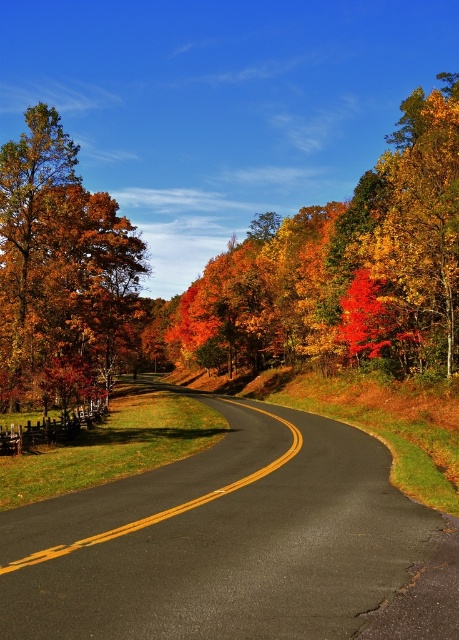
You are a photographer standing on the road and want to capture both the orange autumn leaves at left and the bright red leaves at center in a single frame. Which leaves are closer to the camera based on their positions?

The orange autumn leaves at left are closer to the camera because they are positioned over the bright red leaves at center, indicating they are in front of them.

You are a painter who wants to capture the autumn scene. You have a canvas that can only fit one set of leaves. Based on the image, which set of leaves, the orange autumn leaves at left or the bright red leaves at center, should you choose if you want to paint the wider ones?

The orange autumn leaves at left might be wider than bright red leaves at center, so you should choose the orange autumn leaves at left.

You are standing at the starting point of the winding road and see two points marked on the road surface. The first point is at coordinate point (43, 259) and the second is at point (367, 298). Which point is closer to your current position?

Point (43, 259) is closer to your current position because it is further to the viewer than point (367, 298), meaning it is nearer to you.